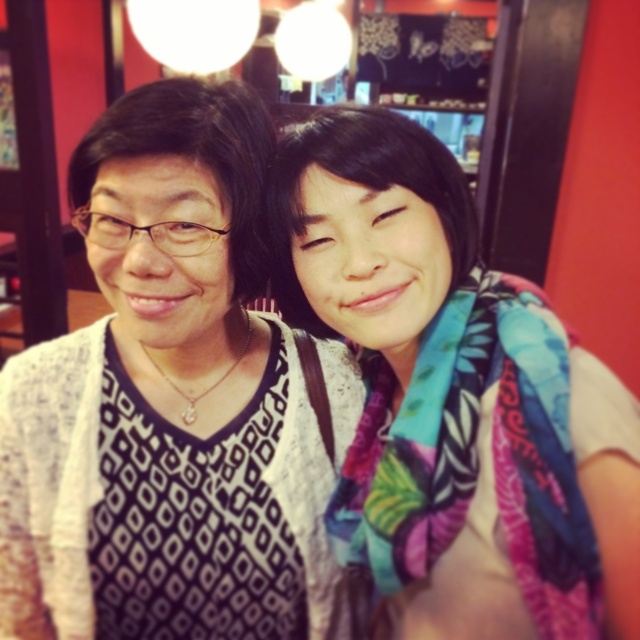
Can you confirm if white textured sweater at center is taller than multicolored scarf at center?

Correct, white textured sweater at center is much taller as multicolored scarf at center.

Is point (198, 97) closer to camera compared to point (566, 532)?

No, it is behind (566, 532).

What are the coordinates of `white textured sweater at center` in the screenshot? It's located at (166, 401).